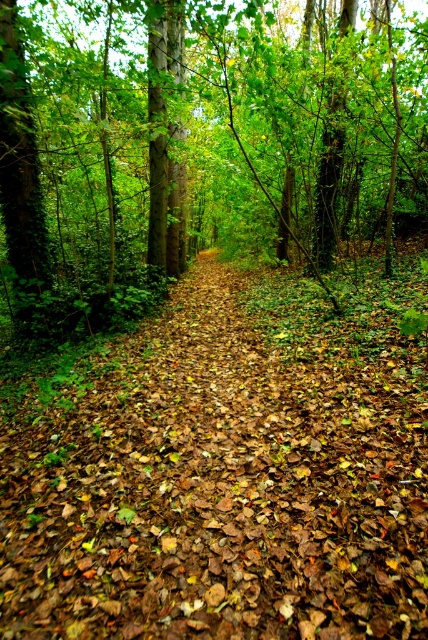
Which is in front, point (199, 410) or point (273, 13)?

Point (199, 410) is more forward.

Is point (253, 570) closer to viewer compared to point (348, 58)?

Yes, it is.

Image resolution: width=428 pixels, height=640 pixels. What are the coordinates of `brown leafy forest path at center` in the screenshot? It's located at (225, 470).

Where is `brown leafy forest path at center`? The height and width of the screenshot is (640, 428). brown leafy forest path at center is located at coordinates click(225, 470).